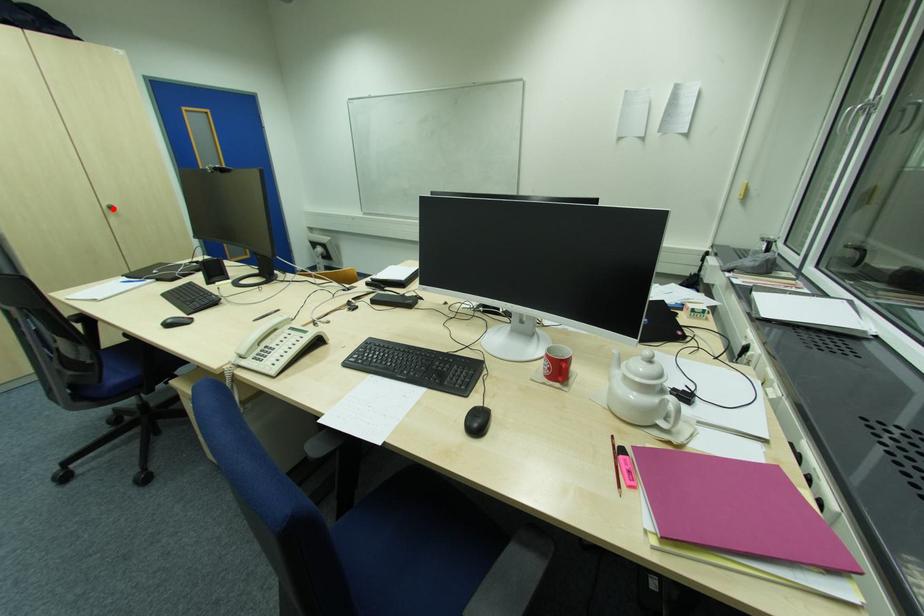
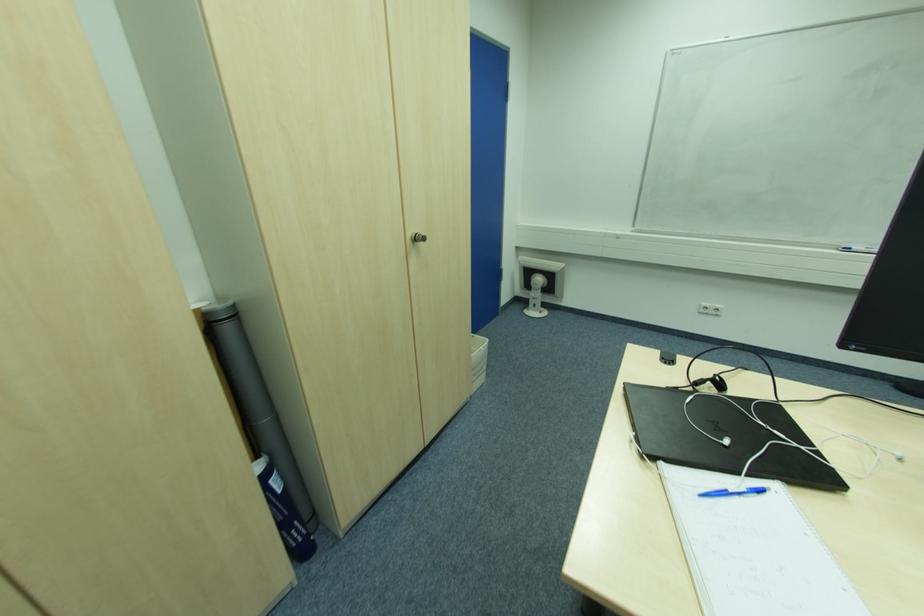
Find the pixel in the second image that matches the highlighted location in the first image.

(419, 240)